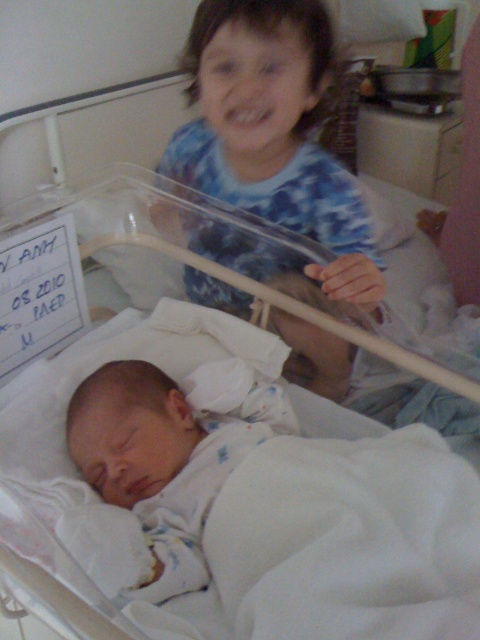
Is white fabric infant bed at center thinner than blue tie-dye shirt at upper center?

Incorrect, white fabric infant bed at center's width is not less than blue tie-dye shirt at upper center's.

How distant is white fabric infant bed at center from blue tie-dye shirt at upper center?

white fabric infant bed at center and blue tie-dye shirt at upper center are 23.41 centimeters apart from each other.

Does point (302, 410) lie behind point (303, 145)?

No, (302, 410) is in front of (303, 145).

At what (x,y) coordinates should I click in order to perform the action: click on white fabric infant bed at center. Please return your answer as a coordinate pair (x, y). The height and width of the screenshot is (640, 480). Looking at the image, I should click on (343, 534).

Can you confirm if blue tie-dye shirt at upper center is shorter than white soft newborn at center?

Incorrect, blue tie-dye shirt at upper center's height does not fall short of white soft newborn at center's.

Measure the distance between blue tie-dye shirt at upper center and camera.

The distance of blue tie-dye shirt at upper center from camera is 38.97 inches.

Between point (237, 92) and point (199, 577), which one is positioned in front?

Point (199, 577) is in front.

The image size is (480, 640). What are the coordinates of `blue tie-dye shirt at upper center` in the screenshot? It's located at (273, 132).

Between white fabric infant bed at center and white soft newborn at center, which one appears on the right side from the viewer's perspective?

From the viewer's perspective, white soft newborn at center appears more on the right side.

Describe the element at coordinates (343, 534) in the screenshot. This screenshot has width=480, height=640. I see `white fabric infant bed at center` at that location.

Image resolution: width=480 pixels, height=640 pixels. I want to click on white fabric infant bed at center, so click(343, 534).